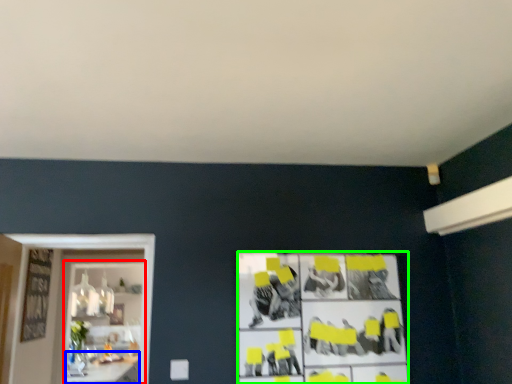
Question: Based on their relative distances, which object is nearer to shelf (highlighted by a red box)? Choose from table (highlighted by a blue box) and poster (highlighted by a green box).

Choices:
 (A) table
 (B) poster

Answer: (A)